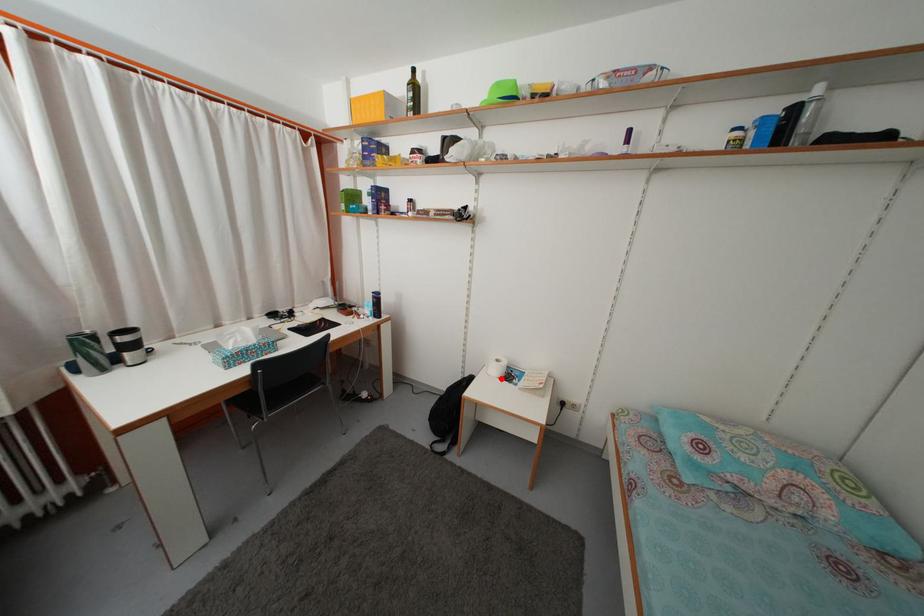
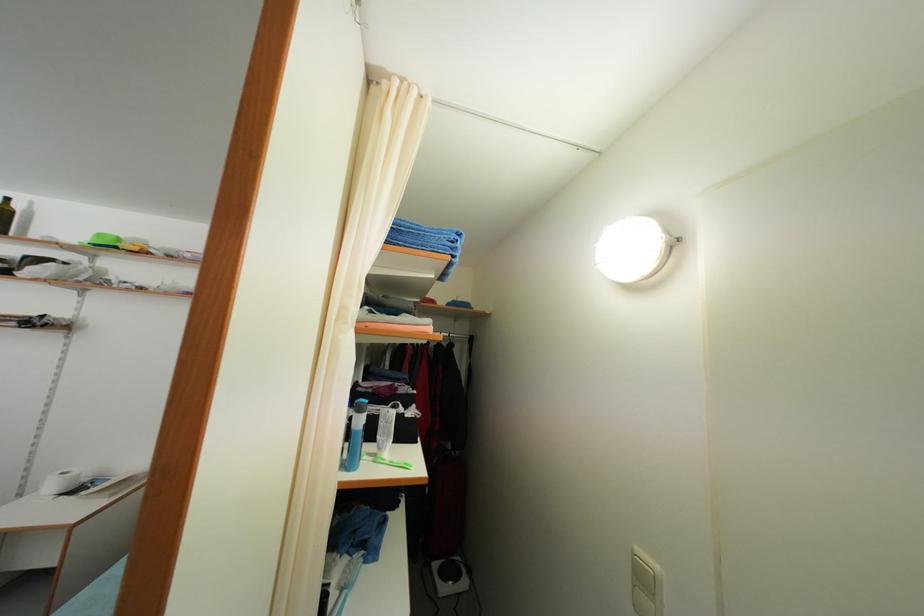
The point at the highlighted location is marked in the first image. Where is the corresponding point in the second image?

(56, 493)